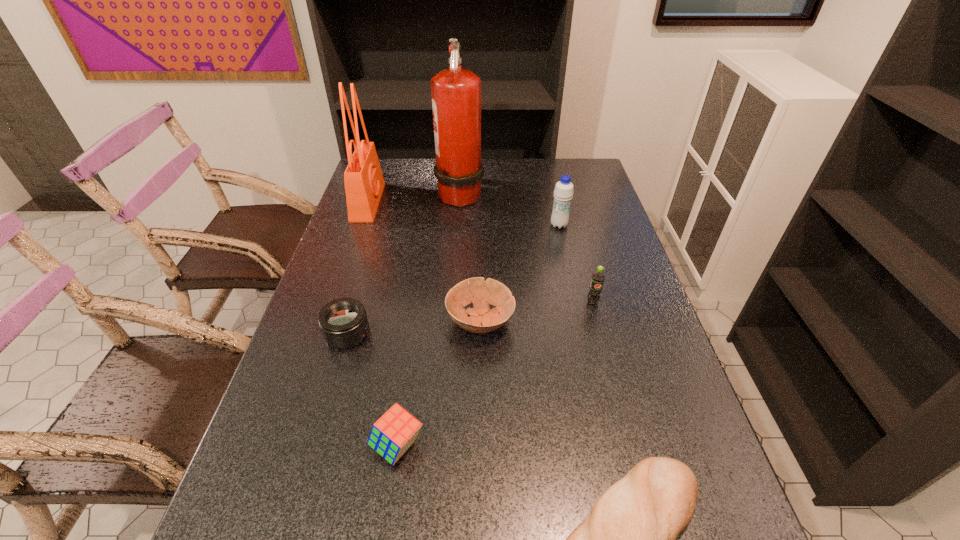
Locate an element on the screen. object identified as the sixth closest to the bread is located at coordinates (456, 93).

Locate an element on the screen. The width and height of the screenshot is (960, 540). free space that satisfies the following two spatial constraints: 1. on the back side of the water bottle; 2. at the nozzle of the tallest object is located at coordinates (552, 193).